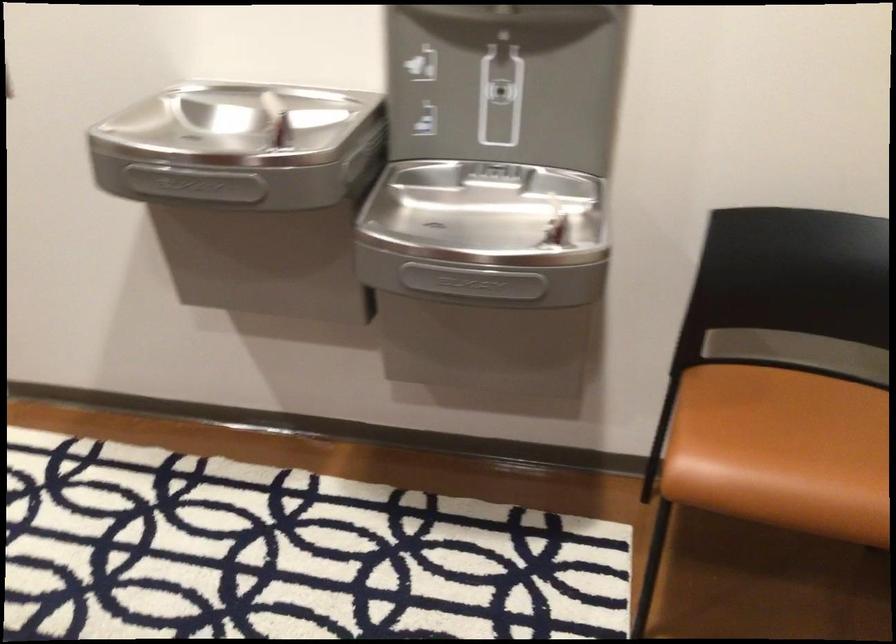
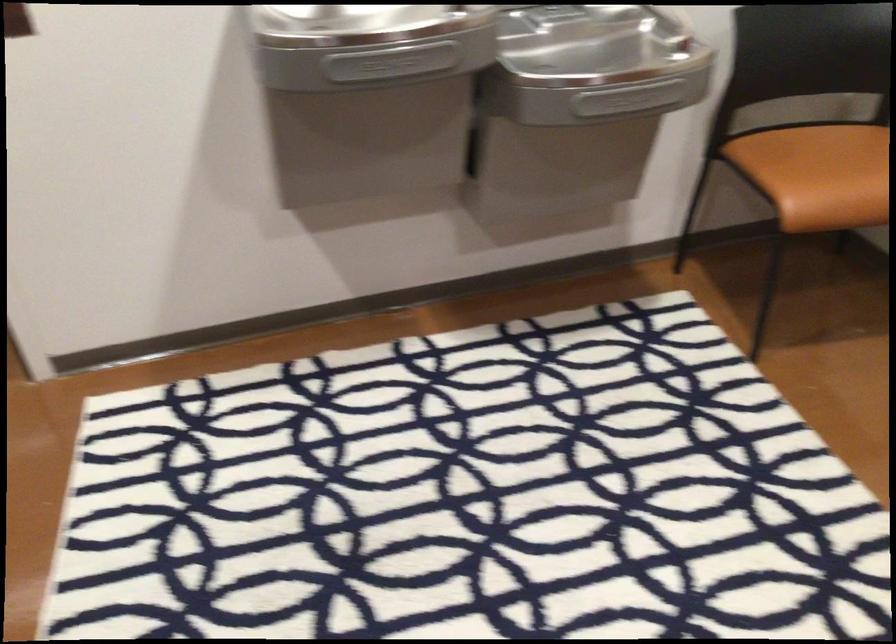
Question: The images are taken continuously from a first-person perspective. In which direction is your viewpoint rotating?

Choices:
 (A) Left
 (B) Right
 (C) Up
 (D) Down

Answer: (B)